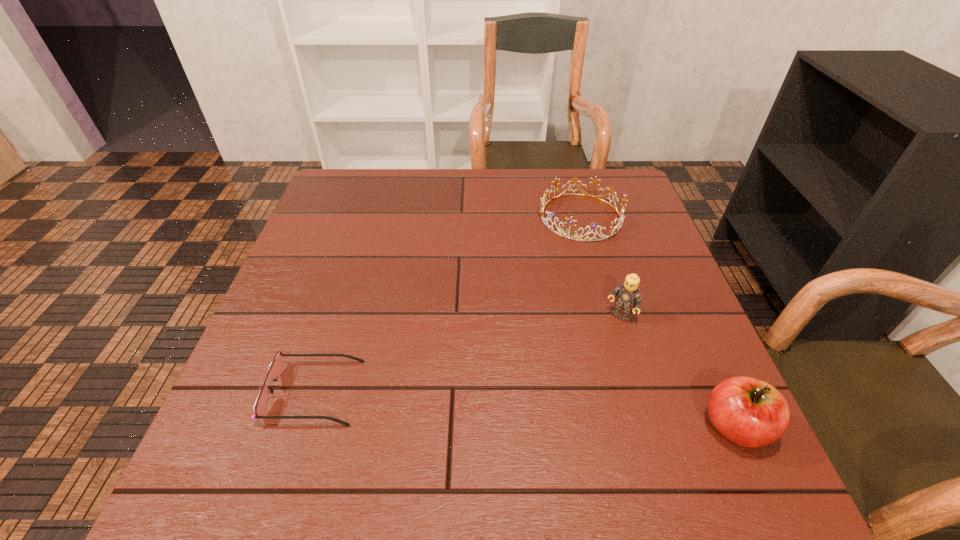
At what (x,y) coordinates should I click in order to perform the action: click on sunglasses. Please return your answer as a coordinate pair (x, y). The width and height of the screenshot is (960, 540). Looking at the image, I should click on (275, 368).

Find the location of a particular element. This screenshot has width=960, height=540. the shortest object is located at coordinates (275, 368).

The height and width of the screenshot is (540, 960). What are the coordinates of `apple` in the screenshot? It's located at (x=749, y=412).

I want to click on Lego, so click(628, 298).

The height and width of the screenshot is (540, 960). I want to click on tiara, so click(570, 221).

Image resolution: width=960 pixels, height=540 pixels. Find the location of `the farthest object`. the farthest object is located at coordinates (570, 221).

This screenshot has width=960, height=540. I want to click on vacant point located 0.300m on the bridge of the leftmost object, so click(x=519, y=392).

Where is `vacant area situated 0.200m on the back of the apple`? vacant area situated 0.200m on the back of the apple is located at coordinates (686, 316).

In order to click on free point located 0.050m in front of the Lego in this screenshot , I will do `click(602, 338)`.

Where is `free region located in front of the Lego`? Image resolution: width=960 pixels, height=540 pixels. free region located in front of the Lego is located at coordinates (587, 356).